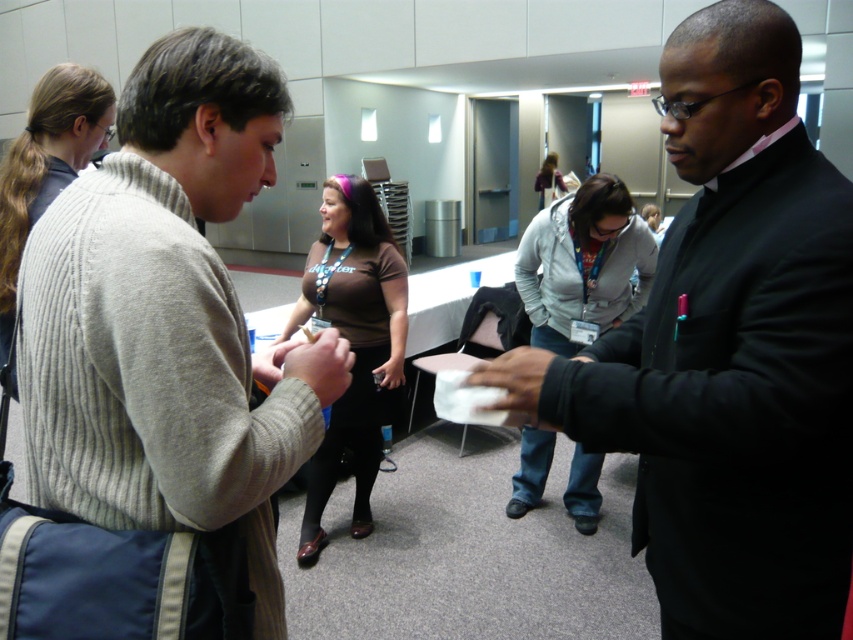
You are a photographer standing in the conference room. You need to take a photo of both the black matte suit at center and the brown matte shirt at center. Which one should you adjust your camera angle to focus on first if you want to capture both in the frame without moving the camera?

You should focus on the brown matte shirt at center first because it is positioned to the left of the black matte suit at center, so capturing it first ensures both will be in the frame without needing to move the camera.

You are a photographer standing in the conference room. You need to take a photo of the gray fleece jacket at center and the matte skin hand at center. Based on their positions, which object should you focus on first to ensure both are in frame?

The gray fleece jacket at center is to the right of matte skin hand at center, so you should focus on the matte skin hand at center first to ensure both are in frame.